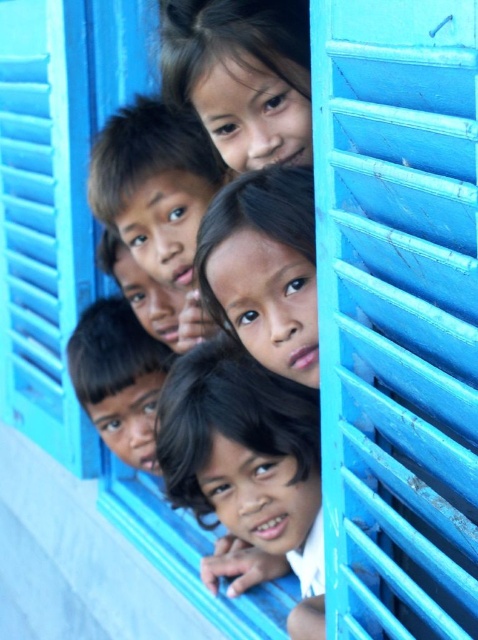
Who is more distant from viewer, (367, 60) or (212, 8)?

Positioned behind is point (212, 8).

Can you confirm if matte blue shutter at center right is positioned to the right of matte black hair at upper center?

Yes, matte blue shutter at center right is to the right of matte black hair at upper center.

Does point (397, 16) come farther from viewer compared to point (283, 141)?

No, (397, 16) is in front of (283, 141).

At what (x,y) coordinates should I click in order to perform the action: click on matte blue shutter at center right. Please return your answer as a coordinate pair (x, y). This screenshot has height=640, width=478. Looking at the image, I should click on (398, 312).

Is point (449, 104) closer to camera compared to point (239, 364)?

Yes, point (449, 104) is closer to viewer.

Who is shorter, matte blue shutter at center right or dark brown hair at center?

With less height is dark brown hair at center.

Image resolution: width=478 pixels, height=640 pixels. What are the coordinates of `matte blue shutter at center right` in the screenshot? It's located at (398, 312).

Who is positioned more to the left, dark brown hair at center or matte black hair at upper center?

Result: Positioned to the left is dark brown hair at center.

Between point (191, 461) and point (182, 29), which one is positioned in front?

Point (182, 29) is more forward.

Between point (271, 490) and point (175, 17), which one is positioned in front?

Point (175, 17) is more forward.

Locate an element on the screen. This screenshot has height=640, width=478. dark brown hair at center is located at coordinates (239, 448).